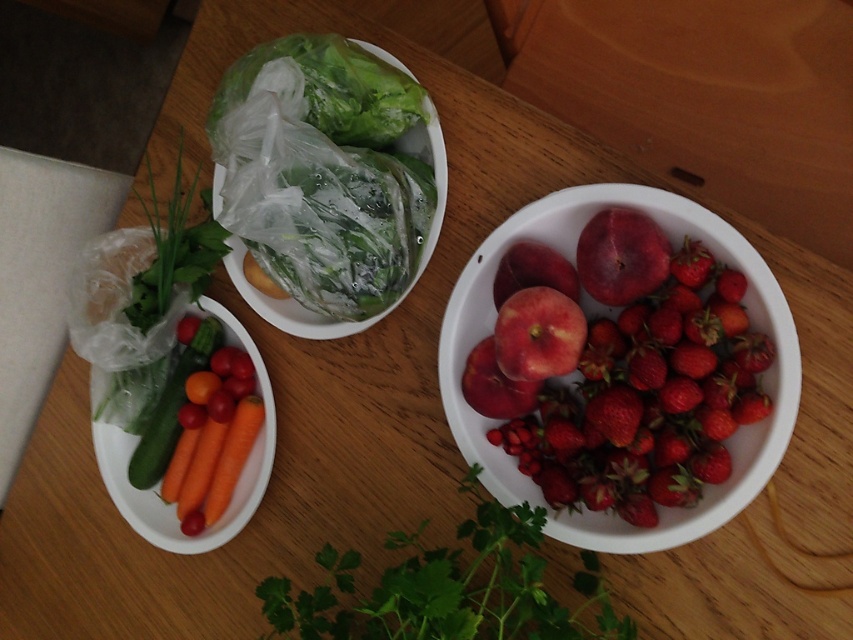
Can you confirm if glossy red apple at upper right is positioned below orange matte carrot at lower left?

No, glossy red apple at upper right is not below orange matte carrot at lower left.

How distant is glossy red apple at upper right from orange matte carrot at lower left?

glossy red apple at upper right is 46.73 centimeters away from orange matte carrot at lower left.

Who is more forward, (607, 260) or (206, 429)?

Point (607, 260)

Identify the location of glossy red apple at upper right. The height and width of the screenshot is (640, 853). (621, 256).

Between smooth plastic carrots at left and green plastic lettuce at upper center, which one is positioned higher?

green plastic lettuce at upper center is above.

Between point (149, 520) and point (282, 307), which one is positioned behind?

Point (149, 520)

The image size is (853, 640). I want to click on smooth plastic carrots at left, so click(158, 484).

Who is positioned more to the left, green plastic lettuce at upper center or orange smooth carrot at lower left?

From the viewer's perspective, orange smooth carrot at lower left appears more on the left side.

Who is shorter, green plastic lettuce at upper center or orange smooth carrot at lower left?

orange smooth carrot at lower left

Based on the photo, measure the distance between point [314,321] and camera.

Point [314,321] and camera are 81.99 centimeters apart.

Find the location of `green plastic lettuce at upper center`. green plastic lettuce at upper center is located at coordinates (380, 310).